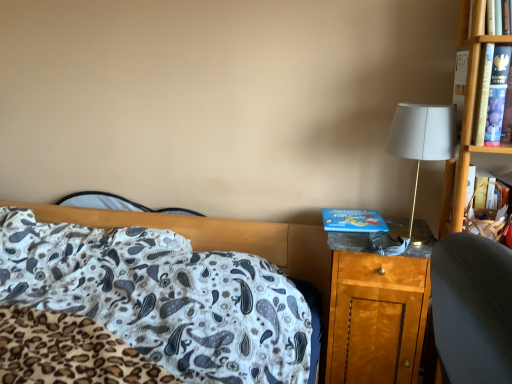
Find the location of a particular element. The width and height of the screenshot is (512, 384). vacant space to the left of white fabric lampshade at right is located at coordinates (350, 227).